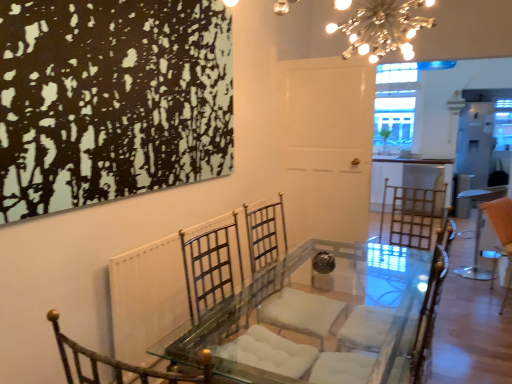
Question: Is metallic gold armchair at center next to orange fabric stool at right?

Choices:
 (A) yes
 (B) no

Answer: (B)

Question: From a real-world perspective, is metallic gold armchair at center on orange fabric stool at right?

Choices:
 (A) yes
 (B) no

Answer: (A)

Question: Is the depth of metallic gold armchair at center greater than that of orange fabric stool at right?

Choices:
 (A) yes
 (B) no

Answer: (B)

Question: Is metallic gold armchair at center aimed at orange fabric stool at right?

Choices:
 (A) no
 (B) yes

Answer: (A)

Question: Is metallic gold armchair at center not inside orange fabric stool at right?

Choices:
 (A) yes
 (B) no

Answer: (A)

Question: Considering the positions of metallic radiator at center and orange fabric swivel chair at right in the image, is metallic radiator at center bigger or smaller than orange fabric swivel chair at right?

Choices:
 (A) small
 (B) big

Answer: (B)

Question: Is metallic radiator at center taller or shorter than orange fabric swivel chair at right?

Choices:
 (A) tall
 (B) short

Answer: (A)

Question: Is metallic radiator at center in front of or behind orange fabric swivel chair at right in the image?

Choices:
 (A) behind
 (B) front

Answer: (B)

Question: Do you think metallic radiator at center is within orange fabric swivel chair at right, or outside of it?

Choices:
 (A) outside
 (B) inside

Answer: (A)

Question: Which is correct: metallic gold armchair at center is inside metallic radiator at center, or outside of it?

Choices:
 (A) outside
 (B) inside

Answer: (A)

Question: From the image's perspective, relative to metallic radiator at center, is metallic gold armchair at center above or below?

Choices:
 (A) below
 (B) above

Answer: (A)

Question: From a real-world perspective, relative to metallic radiator at center, is metallic gold armchair at center vertically above or below?

Choices:
 (A) above
 (B) below

Answer: (B)

Question: Is metallic gold armchair at center in front of or behind metallic radiator at center in the image?

Choices:
 (A) behind
 (B) front

Answer: (A)

Question: In terms of width, does metallic gold armchair at center look wider or thinner when compared to clear glass window at upper center?

Choices:
 (A) wide
 (B) thin

Answer: (A)

Question: From the image's perspective, relative to clear glass window at upper center, is metallic gold armchair at center above or below?

Choices:
 (A) below
 (B) above

Answer: (A)